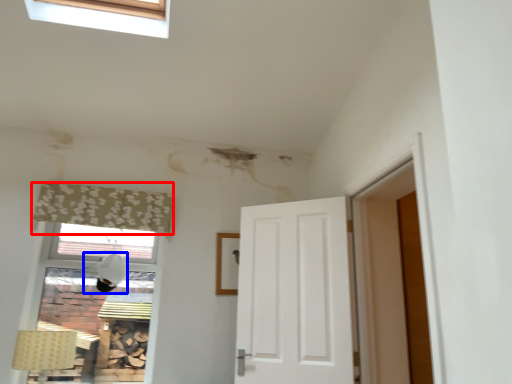
Question: Which point is closer to the camera, curtain (highlighted by a red box) or lamp (highlighted by a blue box)?

Choices:
 (A) curtain
 (B) lamp

Answer: (A)